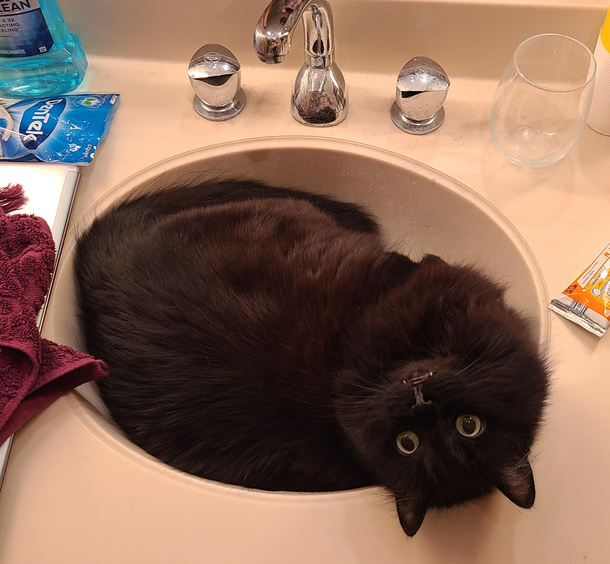
Image resolution: width=610 pixels, height=564 pixels. In order to click on sink in this screenshot , I will do `click(425, 213)`, `click(74, 332)`.